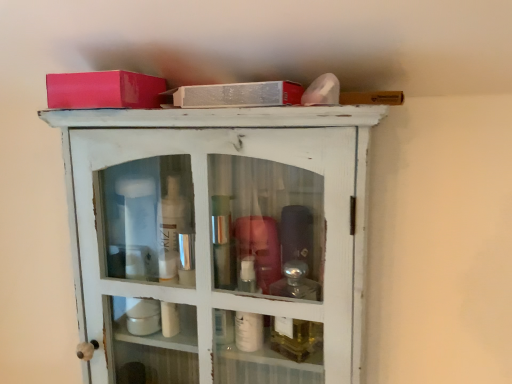
Identify the location of matte pink box at upper left. This screenshot has height=384, width=512. (104, 90).

Describe the element at coordinates (104, 90) in the screenshot. I see `matte pink box at upper left` at that location.

Describe the element at coordinates (220, 241) in the screenshot. I see `white distressed wood cabinet at upper center` at that location.

Where is `white distressed wood cabinet at upper center`? The width and height of the screenshot is (512, 384). white distressed wood cabinet at upper center is located at coordinates (220, 241).

At what (x,y) coordinates should I click in order to perform the action: click on matte pink box at upper left. Please return your answer as a coordinate pair (x, y). This screenshot has height=384, width=512. Looking at the image, I should click on (104, 90).

Is white distressed wood cabinet at upper center at the left side of matte pink box at upper left?

No, white distressed wood cabinet at upper center is not to the left of matte pink box at upper left.

Is the position of white distressed wood cabinet at upper center more distant than that of matte pink box at upper left?

No, white distressed wood cabinet at upper center is closer to the viewer.

Considering the points (116, 178) and (114, 75), which point is behind, point (116, 178) or point (114, 75)?

The point (116, 178) is farther from the camera.

From the image's perspective, which object appears higher, white distressed wood cabinet at upper center or matte pink box at upper left?

matte pink box at upper left appears higher in the image.

Consider the image. From a real-world perspective, which is physically above, white distressed wood cabinet at upper center or matte pink box at upper left?

matte pink box at upper left is physically above.

Is white distressed wood cabinet at upper center wider than matte pink box at upper left?

Correct, the width of white distressed wood cabinet at upper center exceeds that of matte pink box at upper left.

Does white distressed wood cabinet at upper center have a lesser height compared to matte pink box at upper left?

No, white distressed wood cabinet at upper center is not shorter than matte pink box at upper left.

Considering the sizes of objects white distressed wood cabinet at upper center and matte pink box at upper left in the image provided, who is bigger, white distressed wood cabinet at upper center or matte pink box at upper left?

Bigger between the two is white distressed wood cabinet at upper center.

Do you think white distressed wood cabinet at upper center is within matte pink box at upper left, or outside of it?

white distressed wood cabinet at upper center is not inside matte pink box at upper left, it's outside.

Is white distressed wood cabinet at upper center far away from matte pink box at upper left?

They are positioned close to each other.

Could you tell me if white distressed wood cabinet at upper center is facing matte pink box at upper left?

No, white distressed wood cabinet at upper center is not turned towards matte pink box at upper left.

Where is `cupboard located on the right of matte pink box at upper left`? cupboard located on the right of matte pink box at upper left is located at coordinates (220, 241).

Considering the positions of objects matte pink box at upper left and white distressed wood cabinet at upper center in the image provided, who is more to the right, matte pink box at upper left or white distressed wood cabinet at upper center?

Answer: white distressed wood cabinet at upper center is more to the right.

In the image, is matte pink box at upper left positioned in front of or behind white distressed wood cabinet at upper center?

Clearly, matte pink box at upper left is behind white distressed wood cabinet at upper center.

Considering the points (103, 84) and (272, 119), which point is behind, point (103, 84) or point (272, 119)?

The point (103, 84) is more distant.

From the image's perspective, is matte pink box at upper left below white distressed wood cabinet at upper center?

No, from the image's perspective, matte pink box at upper left is not beneath white distressed wood cabinet at upper center.

From a real-world perspective, is matte pink box at upper left over white distressed wood cabinet at upper center?

Yes, from a real-world perspective, matte pink box at upper left is over white distressed wood cabinet at upper center

Does matte pink box at upper left have a lesser width compared to white distressed wood cabinet at upper center?

Yes.

Is matte pink box at upper left taller than white distressed wood cabinet at upper center?

Incorrect, the height of matte pink box at upper left is not larger of that of white distressed wood cabinet at upper center.

Does matte pink box at upper left have a smaller size compared to white distressed wood cabinet at upper center?

Yes, matte pink box at upper left is smaller than white distressed wood cabinet at upper center.

Can we say matte pink box at upper left lies outside white distressed wood cabinet at upper center?

Absolutely, matte pink box at upper left is external to white distressed wood cabinet at upper center.

Would you say matte pink box at upper left is a long distance from white distressed wood cabinet at upper center?

matte pink box at upper left is near white distressed wood cabinet at upper center, not far away.

Is matte pink box at upper left turned away from white distressed wood cabinet at upper center?

No, white distressed wood cabinet at upper center is not at the back of matte pink box at upper left.

Measure the distance between matte pink box at upper left and white distressed wood cabinet at upper center.

21.14 centimeters.

You are a GUI agent. You are given a task and a screenshot of the screen. Output one action in this format:
    pyautogui.click(x=<x>, y=<y>)
    Task: Click on the box that appears above the white distressed wood cabinet at upper center (from the image's perspective)
    This screenshot has width=512, height=384.
    Given the screenshot: What is the action you would take?
    pyautogui.click(x=104, y=90)

Image resolution: width=512 pixels, height=384 pixels. Find the location of `cupboard in front of the matte pink box at upper left`. cupboard in front of the matte pink box at upper left is located at coordinates (220, 241).

The height and width of the screenshot is (384, 512). In the image, there is a matte pink box at upper left. In order to click on cupboard below it (from a real-world perspective) in this screenshot , I will do `click(220, 241)`.